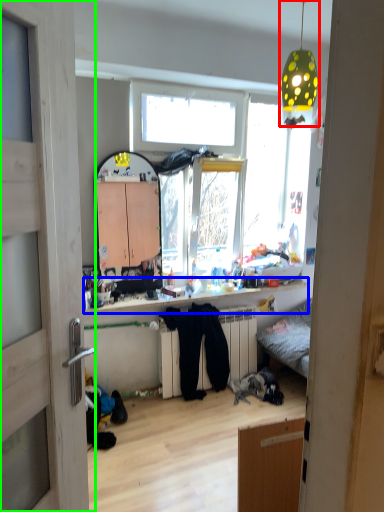
Question: Estimate the real-world distances between objects in this image. Which object is farther from light fixture (highlighted by a red box), counter top (highlighted by a blue box) or door (highlighted by a green box)?

Choices:
 (A) counter top
 (B) door

Answer: (B)